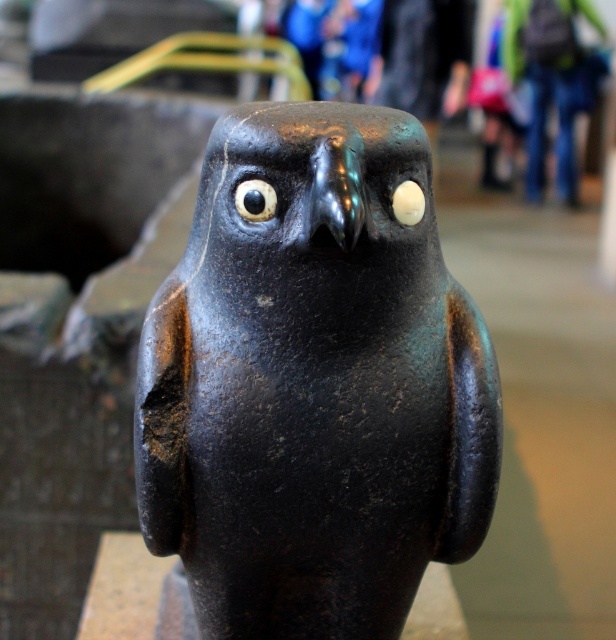
Question: Does matte black bird at center have a larger size compared to black glossy eye at center?

Choices:
 (A) no
 (B) yes

Answer: (B)

Question: Is matte black bird at center to the left of jeans at center from the viewer's perspective?

Choices:
 (A) yes
 (B) no

Answer: (A)

Question: Among these points, which one is nearest to the camera?

Choices:
 (A) (532, 65)
 (B) (240, 547)
 (C) (272, 205)

Answer: (C)

Question: Can you confirm if matte black bird at center is positioned to the left of jeans at center?

Choices:
 (A) yes
 (B) no

Answer: (A)

Question: Which point is closer to the camera?

Choices:
 (A) (423, 385)
 (B) (570, 131)
 (C) (237, 205)

Answer: (C)

Question: Among these points, which one is farthest from the camera?

Choices:
 (A) (564, 86)
 (B) (277, 358)
 (C) (269, 189)

Answer: (A)